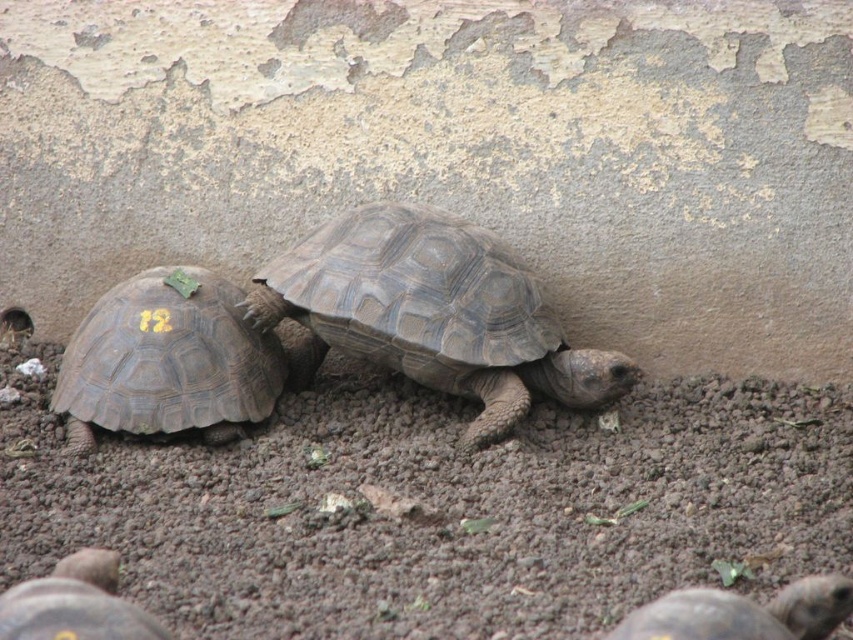
Does dark brown textured shell at center have a lesser height compared to brown textured shell at left?

No, dark brown textured shell at center is not shorter than brown textured shell at left.

Who is positioned more to the right, dark brown textured shell at center or brown textured shell at left?

From the viewer's perspective, dark brown textured shell at center appears more on the right side.

Image resolution: width=853 pixels, height=640 pixels. What are the coordinates of `dark brown textured shell at center` in the screenshot? It's located at (434, 312).

Who is taller, brown textured shell at left or brown textured shell at center?

brown textured shell at left

Does brown textured shell at left lie behind brown textured shell at center?

That is True.

Locate an element on the screen. The width and height of the screenshot is (853, 640). brown textured shell at left is located at coordinates (167, 362).

Does brown textured shell at center have a smaller size compared to dark brown shell at lower left?

No.

How much distance is there between brown textured shell at center and dark brown shell at lower left?

The distance of brown textured shell at center from dark brown shell at lower left is 78.87 centimeters.

The height and width of the screenshot is (640, 853). What do you see at coordinates (741, 612) in the screenshot? I see `brown textured shell at center` at bounding box center [741, 612].

You are a GUI agent. You are given a task and a screenshot of the screen. Output one action in this format:
    pyautogui.click(x=<x>, y=<y>)
    Task: Click on the brown textured shell at center
    Image resolution: width=853 pixels, height=640 pixels.
    Given the screenshot: What is the action you would take?
    pyautogui.click(x=741, y=612)